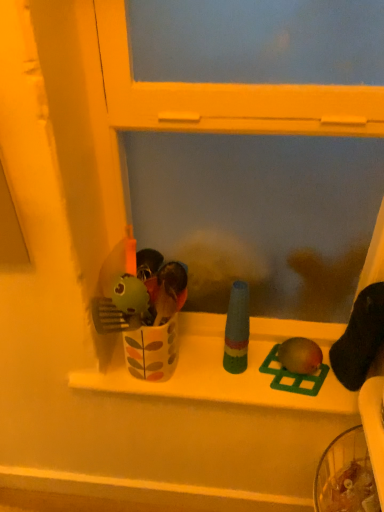
Question: Which is correct: green plastic bird at center, which is counted as the 2th toy, starting from the left, is inside matte green toy at center, which is counted as the first toy, starting from the right, or outside of it?

Choices:
 (A) outside
 (B) inside

Answer: (A)

Question: Is point (296, 376) positioned closer to the camera than point (311, 373)?

Choices:
 (A) closer
 (B) farther

Answer: (B)

Question: Which object is the closest to the matte green toy at center, which is counted as the first toy, starting from the right?

Choices:
 (A) green plastic bird at center, which is counted as the 2th toy, starting from the right
 (B) multicolored plastic bottle at center, the first toy from the left
 (C) white glossy window sill at center

Answer: (A)

Question: Based on their relative distances, which object is farther from the green plastic bird at center, which is counted as the 2th toy, starting from the left?

Choices:
 (A) white glossy window sill at center
 (B) multicolored plastic bottle at center, the first toy from the left
 (C) matte green toy at center, which ranks as the 3th toy in left-to-right order

Answer: (A)